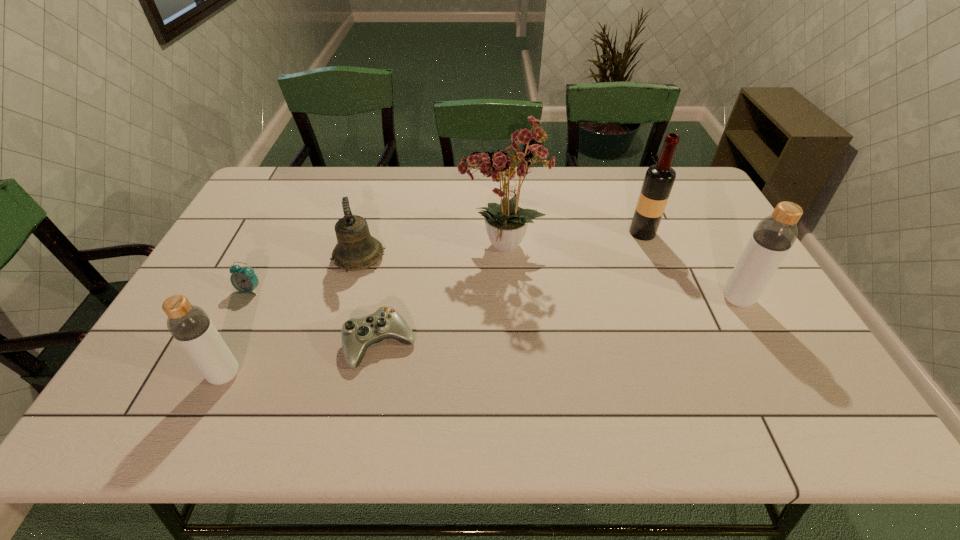
Please point a location where one more bottle can be added evenly. Please provide its 2D coordinates. Your answer should be formatted as a tuple, i.e. [(x, y)], where the tuple contains the x and y coordinates of a point satisfying the conditions above.

[(500, 334)]